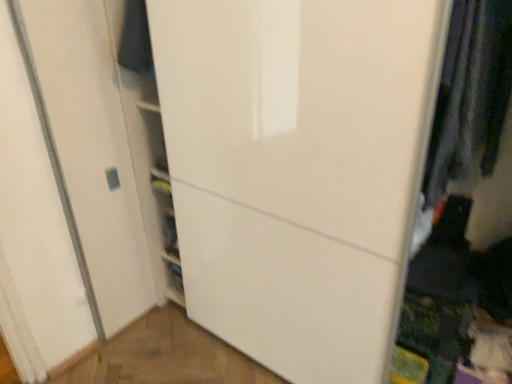
Question: Is dark blue fabric at upper left, which is counted as the first clothing, starting from the left, positioned in front of dark gray fabric at right, marked as the second clothing in a left-to-right arrangement?

Choices:
 (A) no
 (B) yes

Answer: (A)

Question: From a real-world perspective, is dark blue fabric at upper left, which is counted as the first clothing, starting from the left, on top of dark gray fabric at right, marked as the second clothing in a back-to-front arrangement?

Choices:
 (A) no
 (B) yes

Answer: (B)

Question: Is dark blue fabric at upper left, positioned as the 2th clothing in front-to-back order, outside dark gray fabric at right, marked as the second clothing in a back-to-front arrangement?

Choices:
 (A) no
 (B) yes

Answer: (B)

Question: Can you confirm if dark blue fabric at upper left, the 1th clothing from the back, is shorter than dark gray fabric at right, marked as the second clothing in a back-to-front arrangement?

Choices:
 (A) yes
 (B) no

Answer: (A)

Question: Can you confirm if dark blue fabric at upper left, which is counted as the first clothing, starting from the left, is smaller than dark gray fabric at right, marked as the second clothing in a left-to-right arrangement?

Choices:
 (A) no
 (B) yes

Answer: (B)

Question: Is dark blue fabric at upper left, the 1th clothing from the back, looking in the opposite direction of dark gray fabric at right, marked as the second clothing in a back-to-front arrangement?

Choices:
 (A) no
 (B) yes

Answer: (A)

Question: Can you confirm if white glossy door at center is taller than dark gray fabric at right, marked as the second clothing in a left-to-right arrangement?

Choices:
 (A) yes
 (B) no

Answer: (A)

Question: Does white glossy door at center have a lesser height compared to dark gray fabric at right, marked as the second clothing in a left-to-right arrangement?

Choices:
 (A) yes
 (B) no

Answer: (B)

Question: Is white glossy door at center directly adjacent to dark gray fabric at right, marked as the second clothing in a back-to-front arrangement?

Choices:
 (A) yes
 (B) no

Answer: (B)

Question: From a real-world perspective, does white glossy door at center stand above dark gray fabric at right, marked as the second clothing in a back-to-front arrangement?

Choices:
 (A) yes
 (B) no

Answer: (B)

Question: Considering the relative sizes of white glossy door at center and dark gray fabric at right, positioned as the 1th clothing in right-to-left order, in the image provided, is white glossy door at center smaller than dark gray fabric at right, positioned as the 1th clothing in right-to-left order,?

Choices:
 (A) no
 (B) yes

Answer: (A)

Question: Is white glossy door at center wider than dark gray fabric at right, marked as the second clothing in a left-to-right arrangement?

Choices:
 (A) no
 (B) yes

Answer: (B)

Question: From a real-world perspective, is dark gray fabric at right, which is counted as the 1th clothing, starting from the front, located beneath dark blue fabric at upper left, which is the 2th clothing from right to left?

Choices:
 (A) no
 (B) yes

Answer: (B)